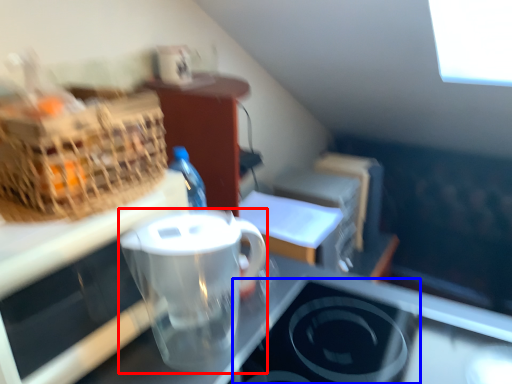
Question: Among these objects, which one is farthest to the camera, coffee cup (highlighted by a red box) or appliance (highlighted by a blue box)?

Choices:
 (A) coffee cup
 (B) appliance

Answer: (A)